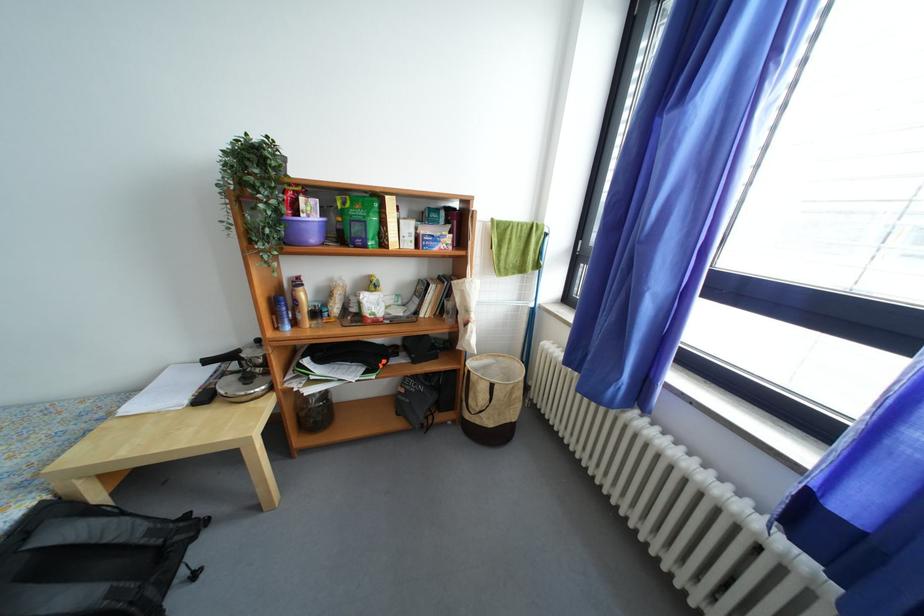
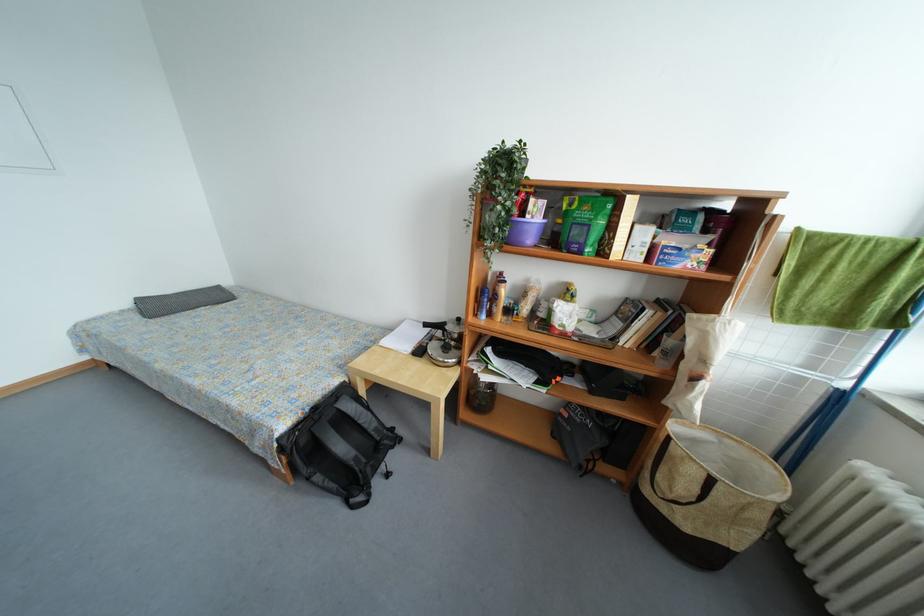
Question: How did the camera likely rotate?

Choices:
 (A) Left
 (B) Right
 (C) Up
 (D) Down

Answer: (A)